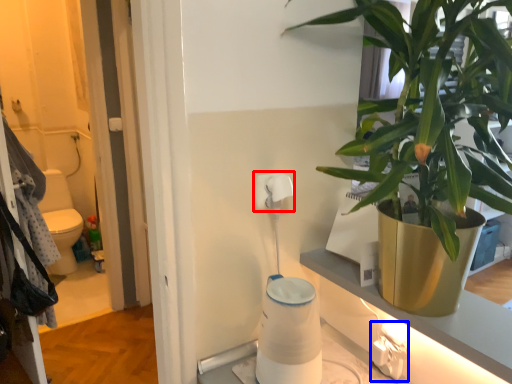
Question: Which object is closer to the camera taking this photo, toilet paper (highlighted by a red box) or electric outlet (highlighted by a blue box)?

Choices:
 (A) toilet paper
 (B) electric outlet

Answer: (B)